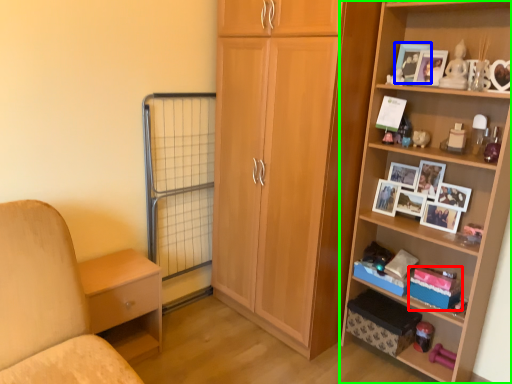
Question: Which is nearer to the storage box (highlighted by a red box)? picture frame (highlighted by a blue box) or shelf (highlighted by a green box).

Choices:
 (A) picture frame
 (B) shelf

Answer: (B)